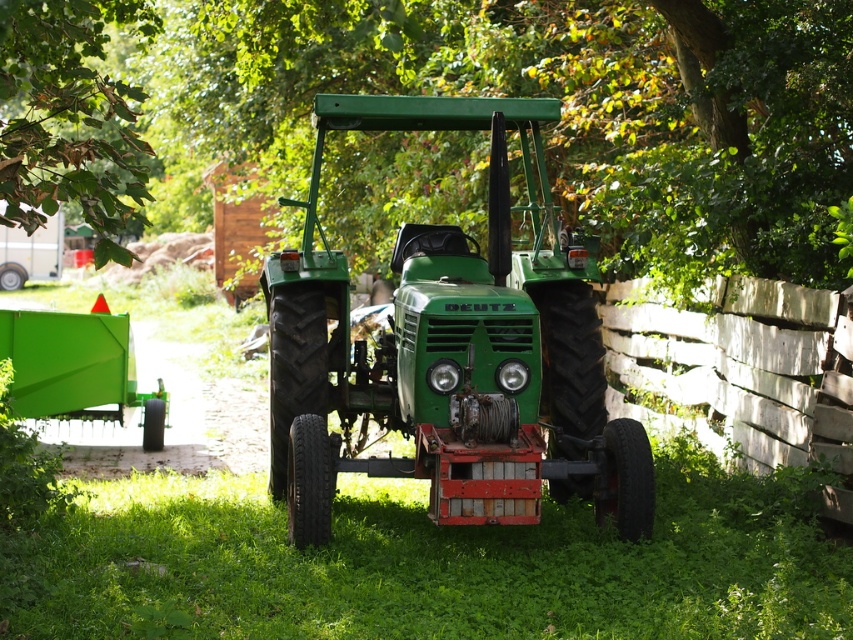
You are standing in a grassy field and see the green leafy tree at upper center and the green matte tractor at center. Which object is nearer to you?

The green leafy tree at upper center is closer to the viewer than the green matte tractor at center, so it is nearer.

You are a farmer who needs to move the green matte tractor at center to a different location. However, you notice the green leafy tree at upper center is in the way. Can you move the tractor without cutting down the tree?

The green leafy tree at upper center is bigger than the green matte tractor at center, but size does not necessarily indicate whether it is blocking the path. To determine if the tree is in the way, you would need to assess the tractor and tree positions relative to the desired path. Since the tree is at upper center and the tractor is at center, moving the tractor might require navigating around the tree or adjusting its position to avoid the tree.

You are a drone operator trying to capture a photo of the green Deutz tractor parked in the grassy area. You need to ensure that both the green leafy tree at upper center and the green grass at center are visible in the frame. Which object should you focus on to ensure both are in the shot?

Since the green leafy tree at upper center is larger than the green grass at center, focusing on the green leafy tree at upper center will help ensure both are visible in the frame as it occupies more space in the scene.